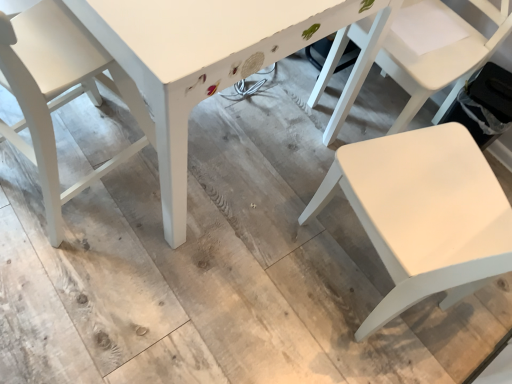
I want to click on vacant space to the right of white matte chair at left, which is counted as the 1th chair, starting from the left, so (x=195, y=206).